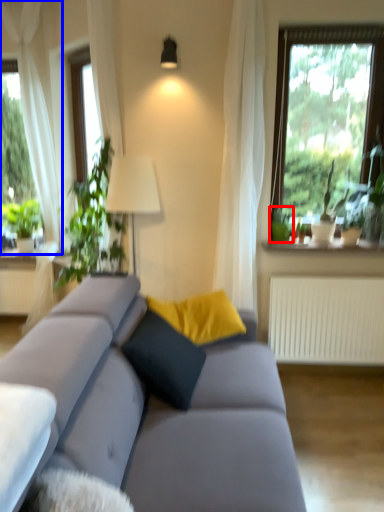
Question: Which object appears farthest to the camera in this image, plant (highlighted by a red box) or curtain (highlighted by a blue box)?

Choices:
 (A) plant
 (B) curtain

Answer: (B)